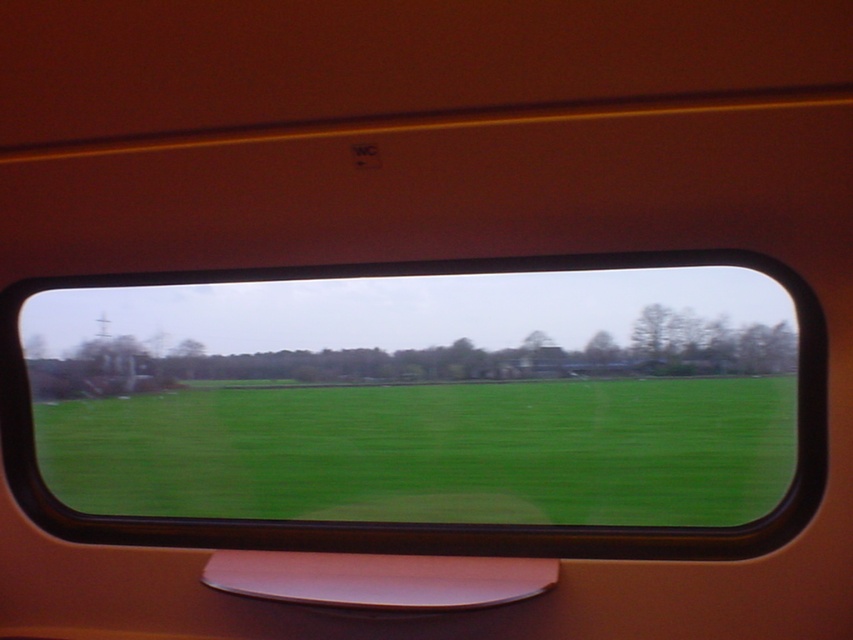
In the scene shown: You are sitting in the train compartment and looking out the window. You want to know the exact location of the green matte field at center in the image. What are its coordinates?

The green matte field at center is located at coordinates point (422, 406).

You are sitting in the train compartment and looking out the window. You notice two green areas in the scene. Which one is closer to you, the green matte field at center or the green grass at center?

The green matte field at center is closer to you because it is in front of the green grass at center.